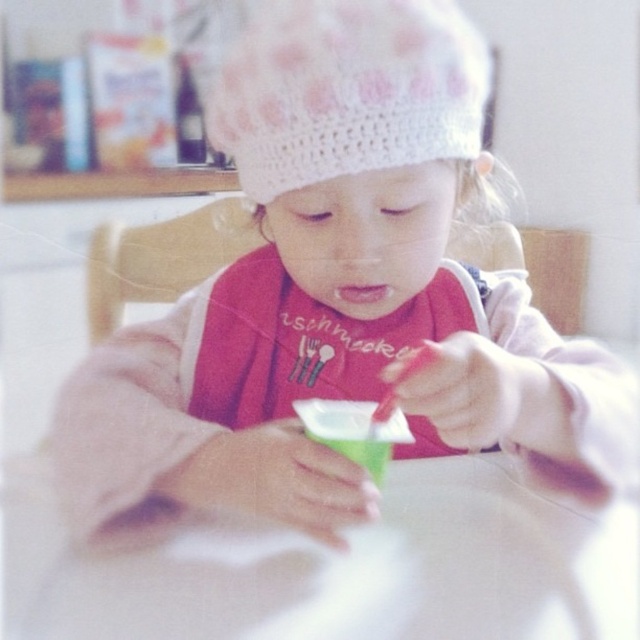
Question: Which of the following is the farthest from the observer?

Choices:
 (A) white knitted hat at upper center
 (B) white glossy table at center

Answer: (A)

Question: Can you confirm if white glossy table at center is positioned above white knitted hat at upper center?

Choices:
 (A) yes
 (B) no

Answer: (B)

Question: Among these points, which one is nearest to the camera?

Choices:
 (A) (300, 115)
 (B) (483, 605)

Answer: (B)

Question: Can you confirm if white glossy table at center is thinner than white knitted hat at upper center?

Choices:
 (A) no
 (B) yes

Answer: (A)

Question: Considering the relative positions of white knitted hat at upper center and green plastic cup at center in the image provided, where is white knitted hat at upper center located with respect to green plastic cup at center?

Choices:
 (A) left
 (B) right

Answer: (A)

Question: Which of the following is the farthest from the observer?

Choices:
 (A) (344, 129)
 (B) (40, 536)
 (C) (384, 461)

Answer: (B)